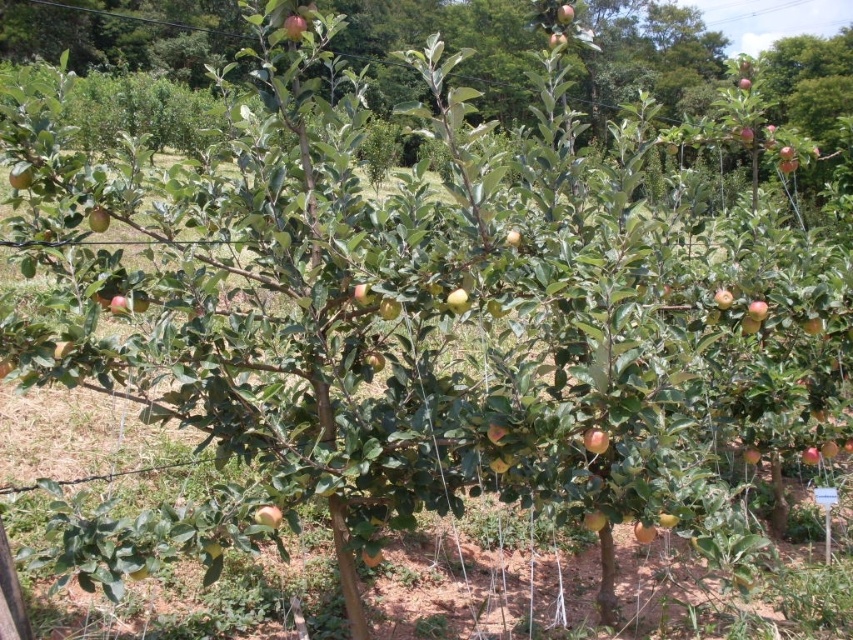
Can you confirm if shiny red apple at center is positioned below green matte apple at center?

Indeed, shiny red apple at center is positioned under green matte apple at center.

Locate an element on the screen. The image size is (853, 640). shiny red apple at center is located at coordinates (268, 515).

The height and width of the screenshot is (640, 853). What do you see at coordinates (268, 515) in the screenshot?
I see `shiny red apple at center` at bounding box center [268, 515].

Where is `shiny red apple at center`? Image resolution: width=853 pixels, height=640 pixels. shiny red apple at center is located at coordinates (268, 515).